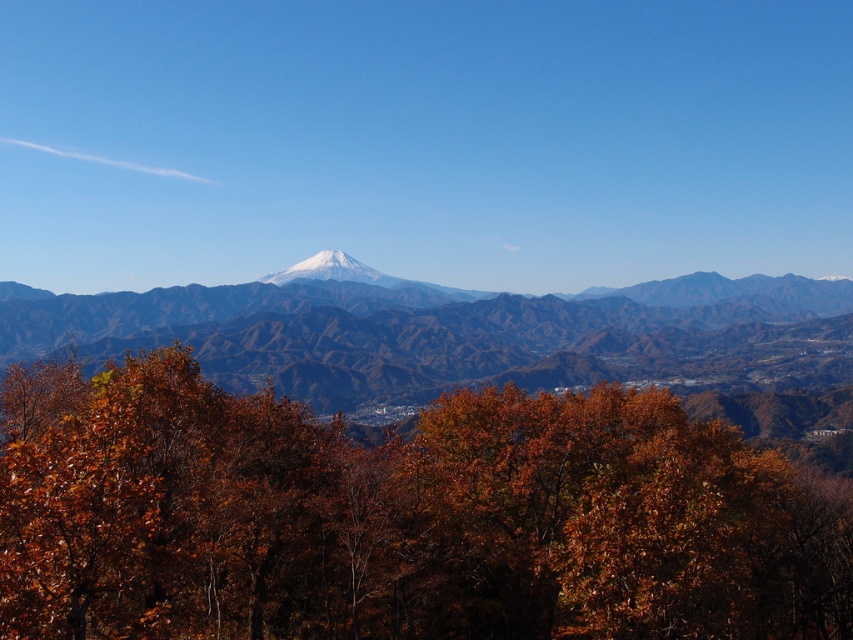
Question: Estimate the real-world distances between objects in this image. Which object is farther from the blue-gray mountain range at center?

Choices:
 (A) brown matte tree at center
 (B) white snow-capped peak at center

Answer: (A)

Question: Which point is closer to the camera?

Choices:
 (A) (781, 344)
 (B) (334, 257)
 (C) (96, 400)

Answer: (C)

Question: Which of the following is the farthest from the observer?

Choices:
 (A) (437, 307)
 (B) (624, 593)
 (C) (276, 276)

Answer: (C)

Question: Is brown matte tree at center in front of white snow-capped peak at center?

Choices:
 (A) yes
 (B) no

Answer: (A)

Question: Can you confirm if brown matte tree at center is positioned below blue-gray mountain range at center?

Choices:
 (A) yes
 (B) no

Answer: (A)

Question: Does brown matte tree at center have a greater width compared to blue-gray mountain range at center?

Choices:
 (A) yes
 (B) no

Answer: (B)